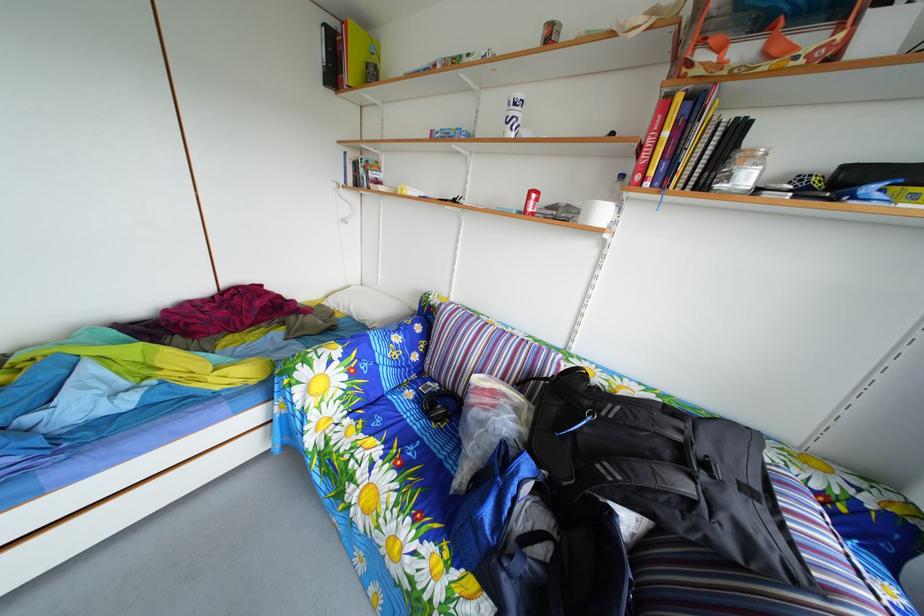
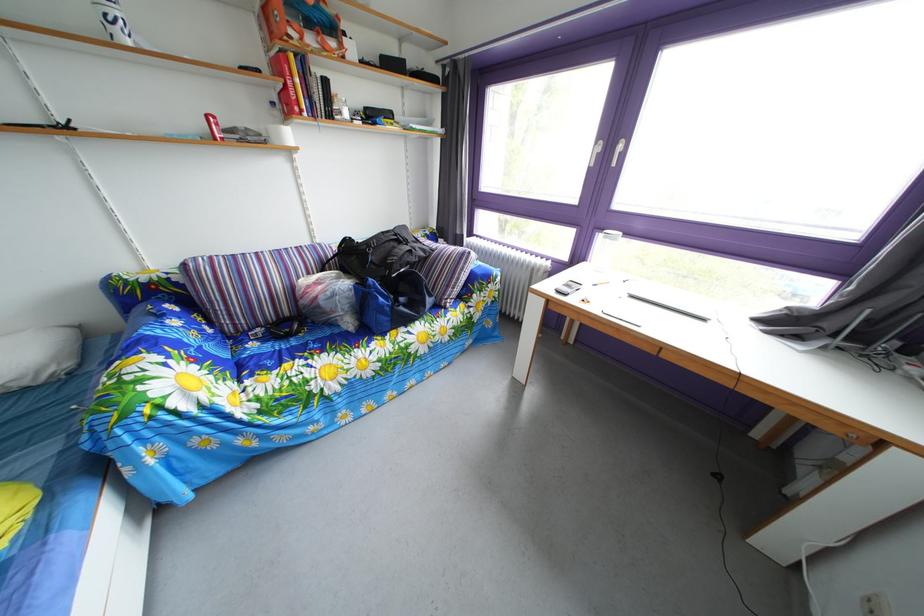
The point at (633,185) is marked in the first image. Where is the corresponding point in the second image?

(284, 111)